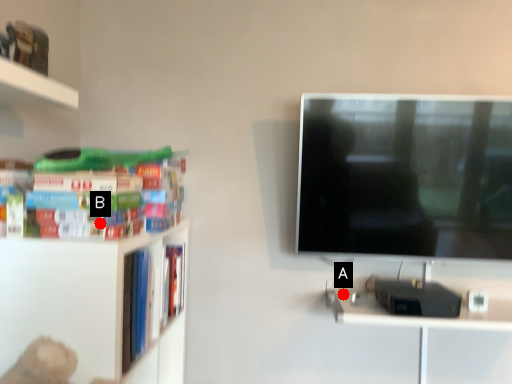
Question: Two points are circled on the image, labeled by A and B beside each circle. Which point is closer to the camera?

Choices:
 (A) A is closer
 (B) B is closer

Answer: (B)